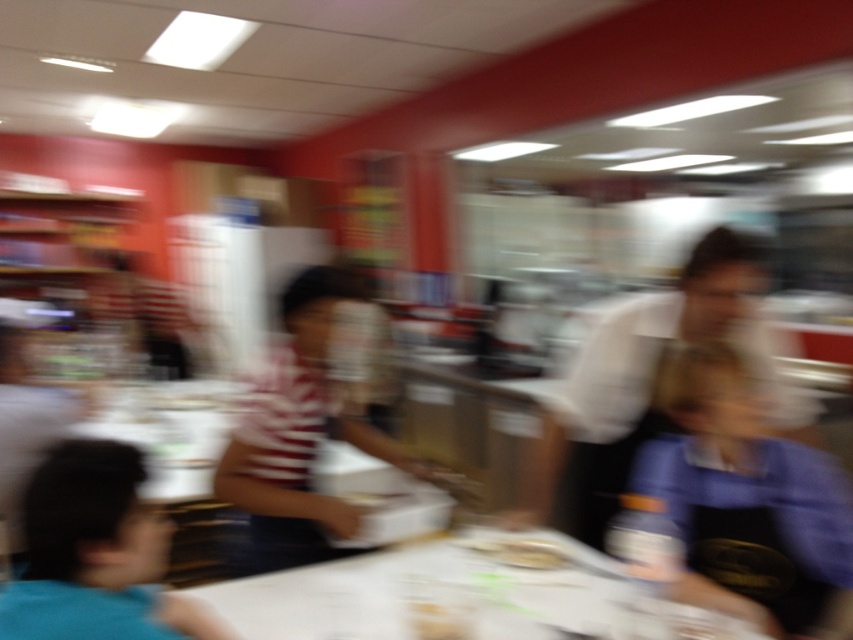
You are at a buffet and want to place your plate on the white paper table at center. However, you notice the white matte shirt at center is in the way. Can you place the plate on the table without moving the shirt?

The white paper table at center is shorter than the white matte shirt at center, so the shirt might block access to the table. You may need to adjust your position or move the shirt slightly to place the plate.

You are a photographer trying to adjust the focus of your camera. You notice the blue fabric shirt at right and the smooth white plate at center are both in the frame. Which object is closer to the camera based on their positions?

The blue fabric shirt at right is closer to the camera because it is in front of the smooth white plate at center.